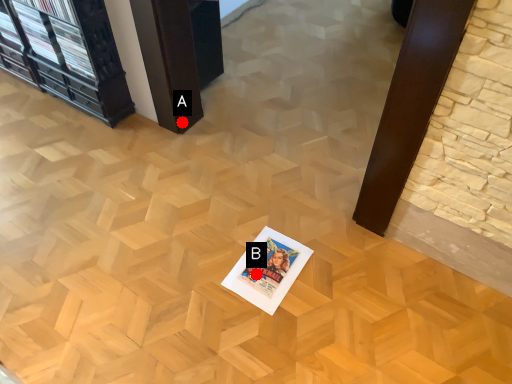
Question: Two points are circled on the image, labeled by A and B beside each circle. Which point appears farthest from the camera in this image?

Choices:
 (A) A is further
 (B) B is further

Answer: (A)